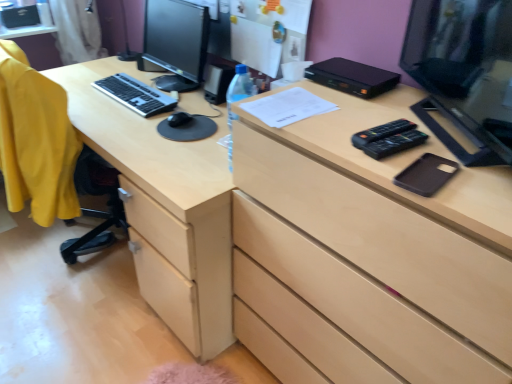
The height and width of the screenshot is (384, 512). I want to click on spots to the right of black matte phone case at right, so click(x=477, y=170).